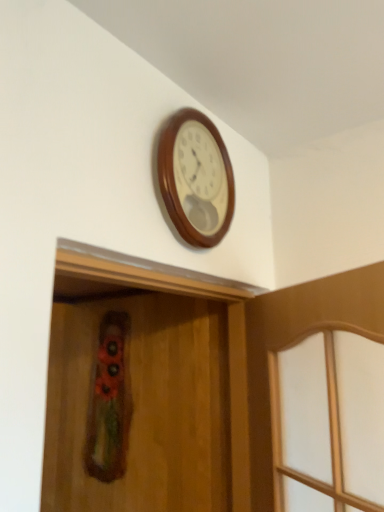
Question: From a real-world perspective, is wooden screen door at center positioned under wooden clock at upper center based on gravity?

Choices:
 (A) yes
 (B) no

Answer: (A)

Question: Considering the relative sizes of wooden screen door at center and wooden clock at upper center in the image provided, is wooden screen door at center bigger than wooden clock at upper center?

Choices:
 (A) no
 (B) yes

Answer: (B)

Question: Is wooden screen door at center aimed at wooden clock at upper center?

Choices:
 (A) yes
 (B) no

Answer: (B)

Question: Is wooden clock at upper center a part of wooden screen door at center?

Choices:
 (A) yes
 (B) no

Answer: (B)

Question: From the image's perspective, is wooden screen door at center over wooden clock at upper center?

Choices:
 (A) yes
 (B) no

Answer: (B)

Question: Is wooden screen door at center behind wooden clock at upper center?

Choices:
 (A) yes
 (B) no

Answer: (B)

Question: Considering the relative sizes of wooden clock at upper center and wooden screen door at center in the image provided, is wooden clock at upper center wider than wooden screen door at center?

Choices:
 (A) no
 (B) yes

Answer: (A)

Question: Is the depth of wooden clock at upper center greater than that of wooden screen door at center?

Choices:
 (A) yes
 (B) no

Answer: (A)

Question: From a real-world perspective, is wooden clock at upper center below wooden screen door at center?

Choices:
 (A) no
 (B) yes

Answer: (A)

Question: From a real-world perspective, is wooden clock at upper center on top of wooden screen door at center?

Choices:
 (A) no
 (B) yes

Answer: (B)

Question: From the image's perspective, would you say wooden clock at upper center is shown under wooden screen door at center?

Choices:
 (A) no
 (B) yes

Answer: (A)

Question: Is wooden clock at upper center at the left side of wooden screen door at center?

Choices:
 (A) no
 (B) yes

Answer: (A)

Question: From a real-world perspective, is wooden clock at upper center positioned above or below wooden screen door at center?

Choices:
 (A) above
 (B) below

Answer: (A)